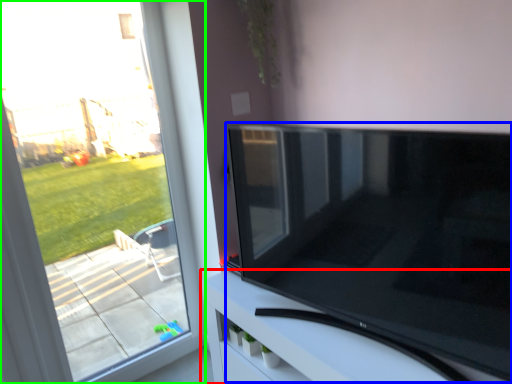
Question: Which object is the closest to the furniture (highlighted by a red box)? Choose among these: television (highlighted by a blue box) or window (highlighted by a green box).

Choices:
 (A) television
 (B) window

Answer: (A)